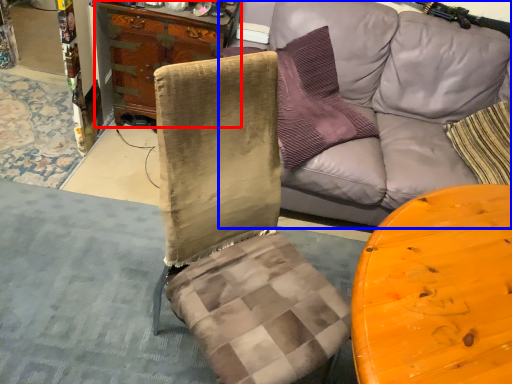
Question: Which object is closer to the camera taking this photo, cabinetry (highlighted by a red box) or studio couch (highlighted by a blue box)?

Choices:
 (A) cabinetry
 (B) studio couch

Answer: (B)